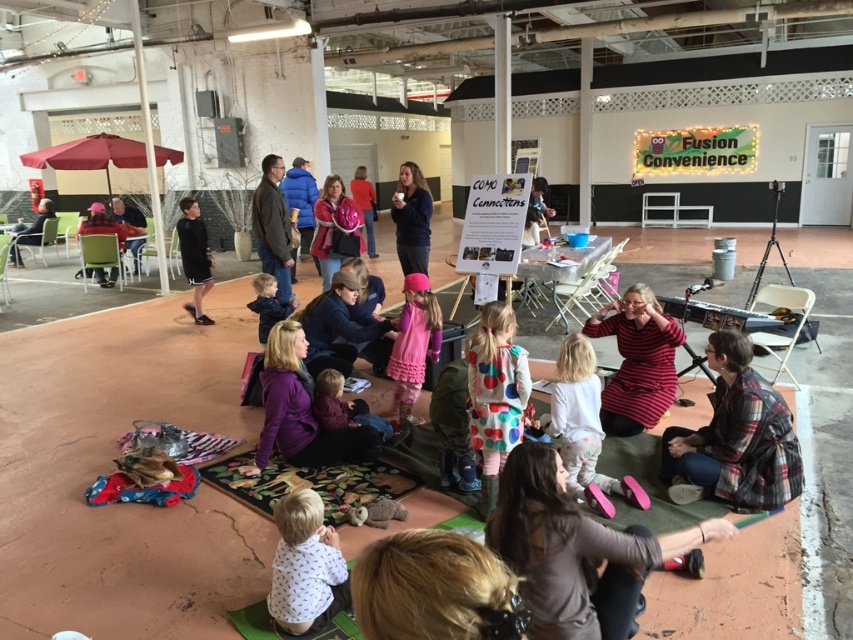
Question: Is matte pink jacket at center above matte black chair at left?

Choices:
 (A) no
 (B) yes

Answer: (A)

Question: Considering the real-world distances, which object is closest to the plaid flannel shirt at lower right?

Choices:
 (A) matte black shorts at left
 (B) pink fabric dress at center
 (C) white soft shirt at lower center
 (D) dark brown leather jacket at lower center

Answer: (D)

Question: Which is farther from the white soft shirt at lower center?

Choices:
 (A) dark blue fleece jacket at center
 (B) dark brown leather jacket at lower center
 (C) pink fabric dress at center

Answer: (A)

Question: Can you confirm if dark brown leather jacket at lower center is smaller than plaid flannel shirt at lower right?

Choices:
 (A) no
 (B) yes

Answer: (B)

Question: Among these points, which one is nearest to the camera?

Choices:
 (A) pyautogui.click(x=42, y=214)
 (B) pyautogui.click(x=184, y=244)

Answer: (B)

Question: Does multicolored felt mat at center appear on the right side of matte black chair at left?

Choices:
 (A) yes
 (B) no

Answer: (A)